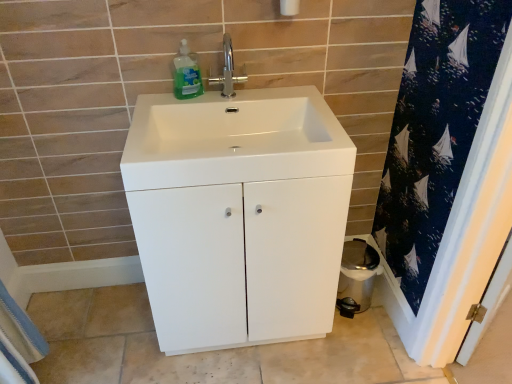
Question: From the image's perspective, is green translucent liquid at upper center under white glossy toilet bowl at lower right?

Choices:
 (A) yes
 (B) no

Answer: (B)

Question: From a real-world perspective, is green translucent liquid at upper center positioned under white glossy toilet bowl at lower right based on gravity?

Choices:
 (A) yes
 (B) no

Answer: (B)

Question: Is green translucent liquid at upper center closer to camera compared to white glossy toilet bowl at lower right?

Choices:
 (A) yes
 (B) no

Answer: (A)

Question: Is green translucent liquid at upper center looking in the opposite direction of white glossy toilet bowl at lower right?

Choices:
 (A) yes
 (B) no

Answer: (B)

Question: Is green translucent liquid at upper center facing towards white glossy toilet bowl at lower right?

Choices:
 (A) no
 (B) yes

Answer: (A)

Question: Is green translucent liquid at upper center located outside white glossy toilet bowl at lower right?

Choices:
 (A) no
 (B) yes

Answer: (B)

Question: Can you confirm if white cotton bath towel at lower left is wider than white glossy sink at center?

Choices:
 (A) no
 (B) yes

Answer: (A)

Question: Considering the relative sizes of white cotton bath towel at lower left and white glossy sink at center in the image provided, is white cotton bath towel at lower left taller than white glossy sink at center?

Choices:
 (A) yes
 (B) no

Answer: (A)

Question: Could you tell me if white cotton bath towel at lower left is turned towards white glossy sink at center?

Choices:
 (A) no
 (B) yes

Answer: (A)

Question: Is the position of white cotton bath towel at lower left more distant than that of white glossy sink at center?

Choices:
 (A) yes
 (B) no

Answer: (A)

Question: Is white cotton bath towel at lower left closer to the viewer compared to white glossy sink at center?

Choices:
 (A) no
 (B) yes

Answer: (A)

Question: Is white cotton bath towel at lower left placed right next to white glossy sink at center?

Choices:
 (A) yes
 (B) no

Answer: (B)

Question: Is white glossy cabinet at center looking in the opposite direction of white cotton bath towel at lower left?

Choices:
 (A) yes
 (B) no

Answer: (B)